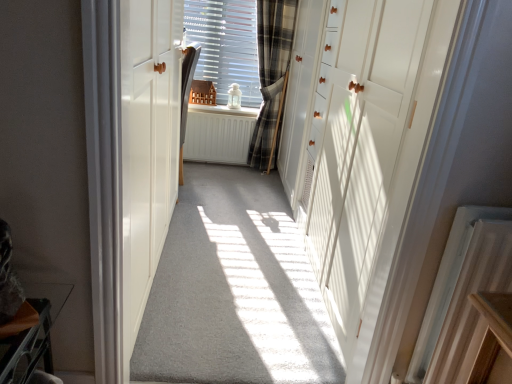
Question: Is point (435, 327) positioned closer to the camera than point (266, 86)?

Choices:
 (A) farther
 (B) closer

Answer: (B)

Question: Visually, is white plastic radiator at lower right, the first radiator viewed from the right, positioned to the left or to the right of plaid fabric curtain at center?

Choices:
 (A) left
 (B) right

Answer: (B)

Question: Based on their relative distances, which object is farther from the plaid fabric at center?

Choices:
 (A) white plastic radiator at lower right, the first radiator viewed from the right
 (B) white painted wood at center
 (C) plaid fabric curtain at center
 (D) white glossy cabinet at right, the first door from the right
 (E) white wood door at left, the first door from the left

Answer: (A)

Question: Considering the real-world distances, which object is farthest from the white matte radiator at center, which is the 1th radiator in top-to-bottom order?

Choices:
 (A) white wood door at left, the 2th door when ordered from right to left
 (B) plaid fabric curtain at center
 (C) white painted wood at center
 (D) plaid fabric at center
 (E) white plastic radiator at lower right, the 2th radiator from the back

Answer: (E)